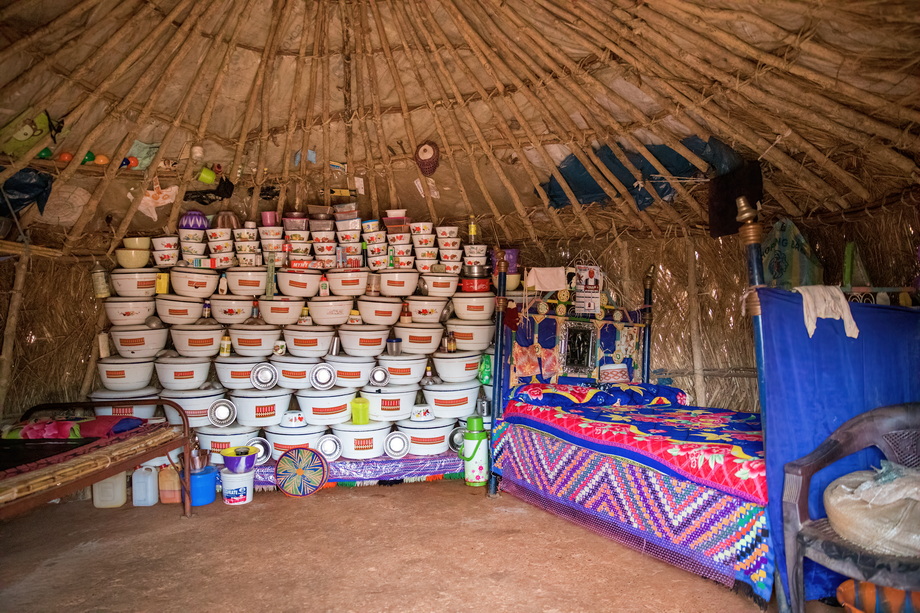
Identify the location of bed. The height and width of the screenshot is (613, 920). (674, 436).